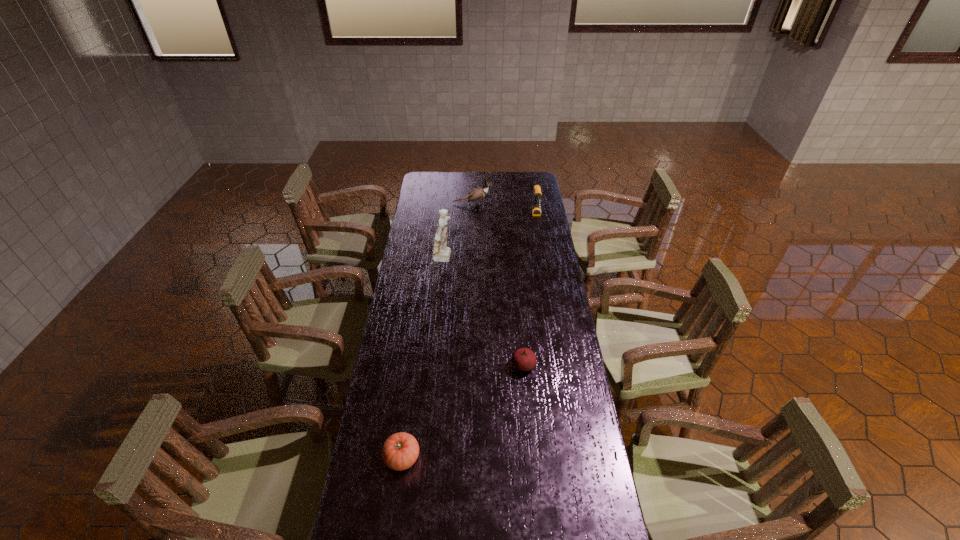
Identify the location of the tallest object. The width and height of the screenshot is (960, 540). (442, 253).

Identify the location of figurine. (442, 253).

Identify the location of bird. The image size is (960, 540). (479, 193).

In order to click on drill in this screenshot , I will do `click(536, 207)`.

Find the location of `the farther tomato`. the farther tomato is located at coordinates (523, 359).

Image resolution: width=960 pixels, height=540 pixels. What are the coordinates of `the fourth object from left to right` in the screenshot? It's located at (523, 359).

Find the location of a particular element. the nearer tomato is located at coordinates (400, 451).

At what (x,y) coordinates should I click in order to perform the action: click on the nearest object. Please return your answer as a coordinate pair (x, y). The height and width of the screenshot is (540, 960). Looking at the image, I should click on (400, 451).

At what (x,y) coordinates should I click in order to perform the action: click on vacant space positioned on the front-facing side of the tallest object. Please return your answer as a coordinate pair (x, y). Image resolution: width=960 pixels, height=540 pixels. Looking at the image, I should click on (516, 259).

Identify the location of vacant space located at the face of the bird. The height and width of the screenshot is (540, 960). (512, 204).